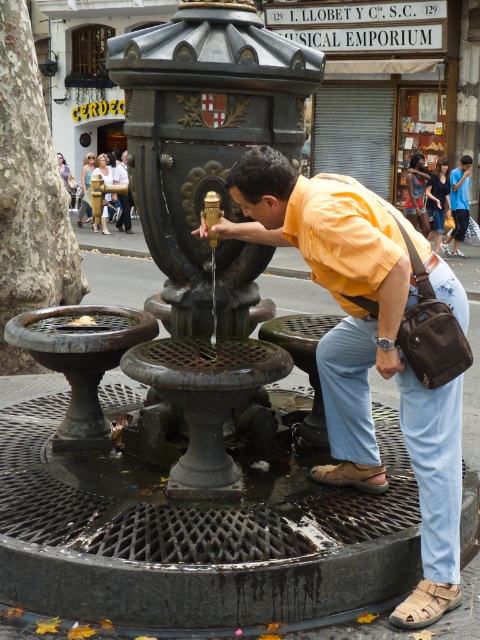
Question: Is tan leather sandal at lower right wider than brown leather sandal at lower center?

Choices:
 (A) no
 (B) yes

Answer: (A)

Question: Which object is the closest to the tan leather sandal at lower right?

Choices:
 (A) matte yellow shirt at center
 (B) brown leather sandal at lower center

Answer: (A)

Question: Which point is closer to the camera?

Choices:
 (A) brown leather sandal at lower center
 (B) tan leather sandal at lower right
 (C) matte yellow shirt at center

Answer: (B)

Question: Which point is closer to the camera taking this photo?

Choices:
 (A) (x=372, y=490)
 (B) (x=407, y=620)

Answer: (B)

Question: Is matte yellow shirt at center closer to camera compared to brown leather sandal at lower center?

Choices:
 (A) no
 (B) yes

Answer: (B)

Question: Is tan leather sandal at lower right positioned before brown leather sandal at lower center?

Choices:
 (A) no
 (B) yes

Answer: (B)